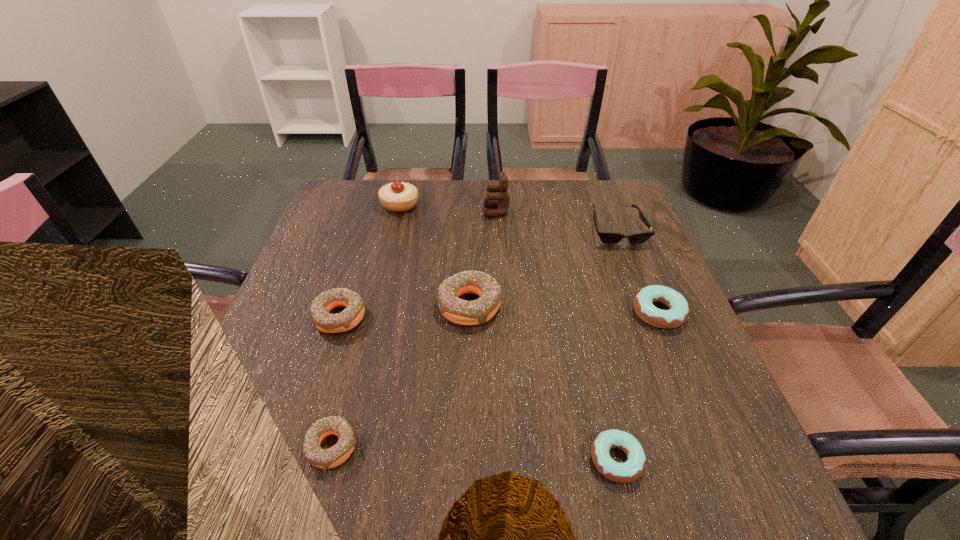
The height and width of the screenshot is (540, 960). Identify the location of free spot located on the back of the smallest chocolate doughnut. (370, 301).

Where is `vacant space located on the left of the sixth object from left to right`? The height and width of the screenshot is (540, 960). vacant space located on the left of the sixth object from left to right is located at coordinates (420, 460).

Locate an element on the screen. teddy bear located at the far edge is located at coordinates (501, 200).

This screenshot has width=960, height=540. I want to click on pastry positioned at the far edge, so click(397, 197).

The image size is (960, 540). Find the location of `sunglasses that is at the far edge`. sunglasses that is at the far edge is located at coordinates (606, 237).

Image resolution: width=960 pixels, height=540 pixels. I want to click on pastry at the left edge, so click(x=397, y=197).

Find the location of `sunglasses that is at the right edge`. sunglasses that is at the right edge is located at coordinates point(606,237).

You are a GUI agent. You are given a task and a screenshot of the screen. Output one action in this format:
    pyautogui.click(x=<x>, y=<y>)
    Task: Click on the doughnut that is at the right edge
    
    Given the screenshot: What is the action you would take?
    pyautogui.click(x=678, y=312)

Where is `object that is positioned at the far left corner`? object that is positioned at the far left corner is located at coordinates (397, 197).

You are a GUI agent. You are given a task and a screenshot of the screen. Output one action in this format:
    pyautogui.click(x=<x>, y=<y>)
    Task: Click on the object present at the near left corner
    
    Given the screenshot: What is the action you would take?
    pyautogui.click(x=332, y=457)